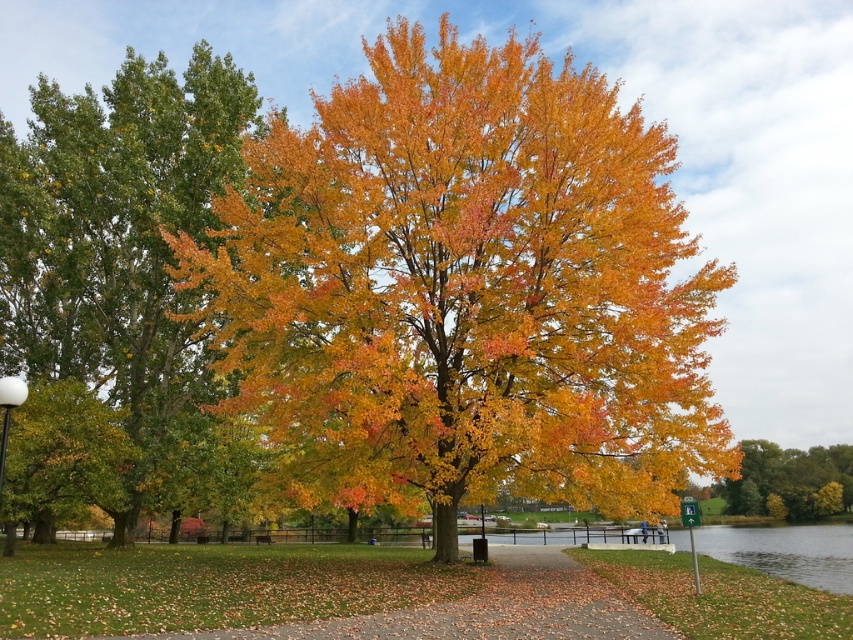
You are a park visitor standing at the entrance of the park. You see the green leafy tree at left and the white glossy lamp post at lower left. Which object is higher up in the scene?

The green leafy tree at left is located above the white glossy lamp post at lower left, so it is higher up in the scene.

You are standing on the paved pathway in the park and notice both the golden yellow leaves at center and the shiny green leaf at left. Which of these two objects is positioned higher relative to the ground?

The golden yellow leaves at center is above the shiny green leaf at left, so it is positioned higher relative to the ground.

You are standing on the paved pathway in the park and want to pick up the golden yellow leaves at right. Which direction should you walk to reach them from the green leafy tree at left?

Since the green leafy tree at left is to the left of golden yellow leaves at right, you should walk to the right to reach the golden yellow leaves at right from the green leafy tree at left.